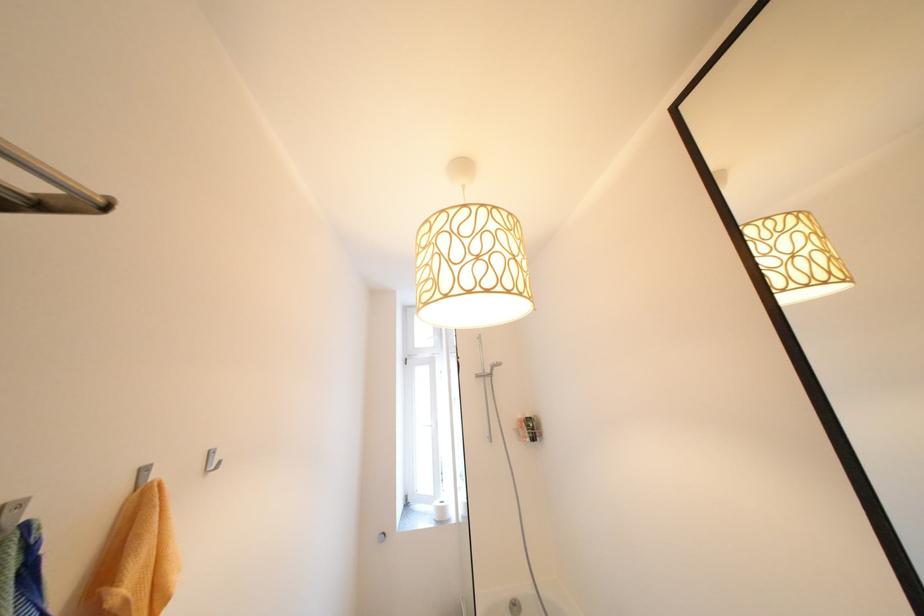
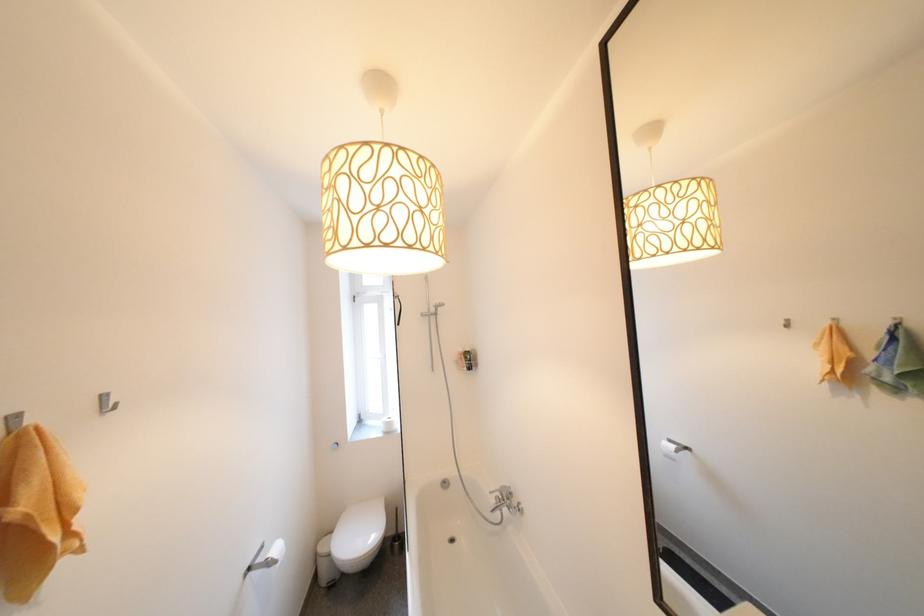
Question: How did the camera likely rotate?

Choices:
 (A) Left
 (B) Right
 (C) Up
 (D) Down

Answer: (D)